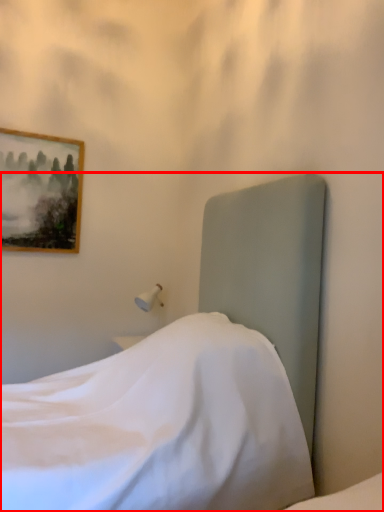
Question: Considering the relative positions of bed (annotated by the red box) and picture frame in the image provided, where is bed (annotated by the red box) located with respect to the staircase?

Choices:
 (A) left
 (B) right

Answer: (B)